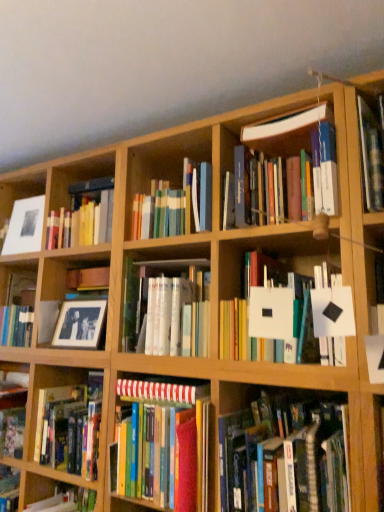
Question: Is white glossy book at center, which appears as the fourth book when ordered from the bottom, positioned far away from hardcover books at center, which is counted as the 1th book, starting from the bottom?

Choices:
 (A) yes
 (B) no

Answer: (B)

Question: Does white glossy book at center, which appears as the fourth book when ordered from the bottom, have a greater height compared to hardcover books at center, the sixth book from the top?

Choices:
 (A) yes
 (B) no

Answer: (B)

Question: Does white glossy book at center, which appears as the fourth book when ordered from the bottom, have a lesser height compared to hardcover books at center, the sixth book from the top?

Choices:
 (A) yes
 (B) no

Answer: (A)

Question: Is white glossy book at center, which appears as the fourth book when ordered from the bottom, not inside hardcover books at center, which is counted as the 1th book, starting from the bottom?

Choices:
 (A) no
 (B) yes

Answer: (B)

Question: Can you confirm if white glossy book at center, which appears as the fourth book when ordered from the bottom, is smaller than hardcover books at center, which is counted as the 1th book, starting from the bottom?

Choices:
 (A) yes
 (B) no

Answer: (B)

Question: In terms of height, does black matte photo frame at left look taller or shorter compared to striped paper at center, which appears as the 2th book when ordered from the bottom?

Choices:
 (A) tall
 (B) short

Answer: (A)

Question: Is point (57, 278) positioned closer to the camera than point (137, 395)?

Choices:
 (A) farther
 (B) closer

Answer: (A)

Question: Would you say black matte photo frame at left is to the left or to the right of striped paper at center, which appears as the 2th book when ordered from the bottom, in the picture?

Choices:
 (A) left
 (B) right

Answer: (A)

Question: Is black matte photo frame at left bigger or smaller than striped paper at center, positioned as the fifth book in top-to-bottom order?

Choices:
 (A) big
 (B) small

Answer: (B)

Question: From a real-world perspective, relative to striped paper at center, which appears as the 2th book when ordered from the bottom, is white matte paper at center, the 2th book when ordered from top to bottom, vertically above or below?

Choices:
 (A) below
 (B) above

Answer: (B)

Question: From their relative heights in the image, would you say white matte paper at center, the 2th book when ordered from top to bottom, is taller or shorter than striped paper at center, positioned as the fifth book in top-to-bottom order?

Choices:
 (A) tall
 (B) short

Answer: (A)

Question: Considering the relative positions of white matte paper at center, marked as the 5th book in a bottom-to-top arrangement, and striped paper at center, positioned as the fifth book in top-to-bottom order, in the image provided, is white matte paper at center, marked as the 5th book in a bottom-to-top arrangement, to the left or to the right of striped paper at center, positioned as the fifth book in top-to-bottom order,?

Choices:
 (A) left
 (B) right

Answer: (B)

Question: Is white matte paper at center, marked as the 5th book in a bottom-to-top arrangement, situated inside striped paper at center, positioned as the fifth book in top-to-bottom order, or outside?

Choices:
 (A) inside
 (B) outside

Answer: (B)

Question: Is point (258, 172) closer or farther from the camera than point (309, 335)?

Choices:
 (A) closer
 (B) farther

Answer: (B)

Question: Considering the positions of hardcover books at center, acting as the 6th book starting from the bottom, and white matte paper at center, marked as the 5th book in a bottom-to-top arrangement, in the image, is hardcover books at center, acting as the 6th book starting from the bottom, taller or shorter than white matte paper at center, marked as the 5th book in a bottom-to-top arrangement,?

Choices:
 (A) short
 (B) tall

Answer: (A)